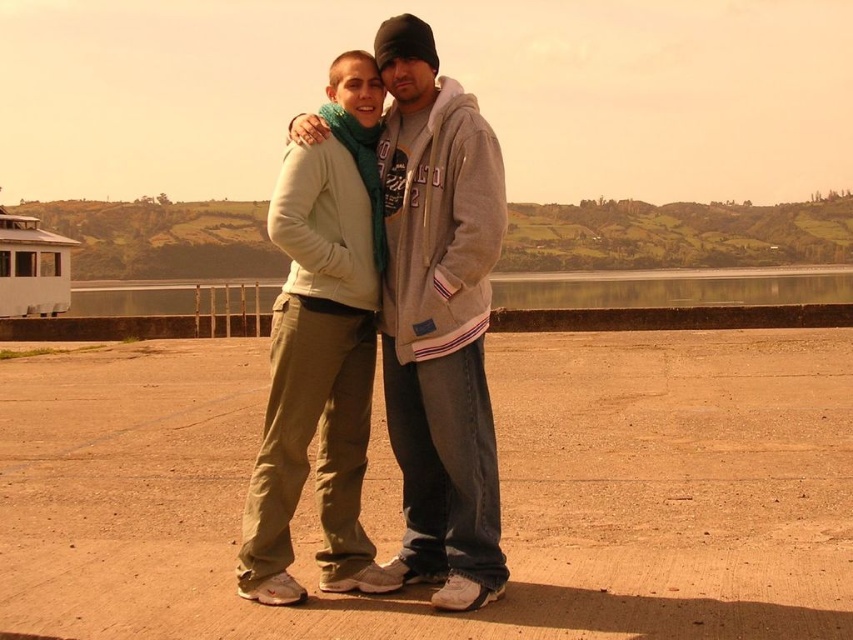
You are designing a layout for a magazine cover and want to place the matte gray hoodie at center and the transparent glass water at center in a way that respects their sizes. Which object should you place in a smaller area to maintain visual balance?

Since the matte gray hoodie at center occupies less space than the transparent glass water at center, you should place the matte gray hoodie at center in a smaller area to maintain visual balance.

You are trying to determine which object is taller between the matte gray hoodie at center and the transparent glass water at center. Based on the scene, can you figure out which one is taller?

The matte gray hoodie at center has a lesser height compared to transparent glass water at center, so the transparent glass water at center is taller.

You are taking a photo of two people standing in a field. You notice two points in the image labeled as point (442, 362) and point (584, 285). Which point is closer to the camera?

Point (442, 362) is closer to the camera than point (584, 285).